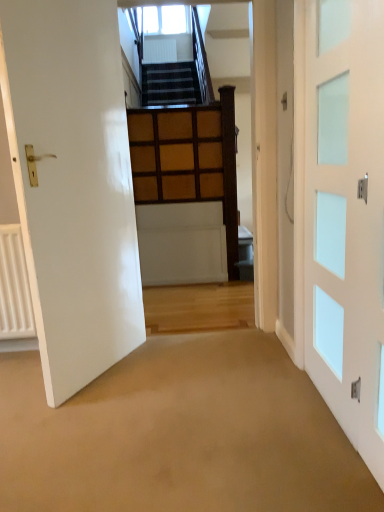
Question: Is white glass door at right, which appears as the 2th door when viewed from the left, facing towards clear glass window at upper center?

Choices:
 (A) no
 (B) yes

Answer: (A)

Question: From the image's perspective, is white glass door at right, which is the 1th door in right-to-left order, above clear glass window at upper center?

Choices:
 (A) no
 (B) yes

Answer: (A)

Question: Does white glass door at right, which appears as the 2th door when viewed from the left, have a greater width compared to clear glass window at upper center?

Choices:
 (A) yes
 (B) no

Answer: (B)

Question: Would you say white glass door at right, which appears as the 2th door when viewed from the left, contains clear glass window at upper center?

Choices:
 (A) no
 (B) yes

Answer: (A)

Question: Can you confirm if white glass door at right, which is the 1th door in right-to-left order, is shorter than clear glass window at upper center?

Choices:
 (A) yes
 (B) no

Answer: (B)

Question: From the image's perspective, is white glossy door at left, arranged as the 2th door when viewed from the right, located above or below clear glass window at upper center?

Choices:
 (A) above
 (B) below

Answer: (B)

Question: Is white glossy door at left, the 1th door in the left-to-right sequence, taller or shorter than clear glass window at upper center?

Choices:
 (A) short
 (B) tall

Answer: (B)

Question: In the image, is white glossy door at left, arranged as the 2th door when viewed from the right, positioned in front of or behind clear glass window at upper center?

Choices:
 (A) front
 (B) behind

Answer: (A)

Question: Based on their sizes in the image, would you say white glossy door at left, arranged as the 2th door when viewed from the right, is bigger or smaller than clear glass window at upper center?

Choices:
 (A) big
 (B) small

Answer: (A)

Question: Is point (153, 14) positioned closer to the camera than point (142, 332)?

Choices:
 (A) farther
 (B) closer

Answer: (A)

Question: Is clear glass window at upper center situated inside white glossy door at left, arranged as the 2th door when viewed from the right, or outside?

Choices:
 (A) outside
 (B) inside

Answer: (A)

Question: In the image, is clear glass window at upper center on the left side or the right side of white glossy door at left, arranged as the 2th door when viewed from the right?

Choices:
 (A) left
 (B) right

Answer: (B)

Question: From a real-world perspective, is clear glass window at upper center above or below white glossy door at left, the 1th door in the left-to-right sequence?

Choices:
 (A) below
 (B) above

Answer: (B)

Question: Looking at the image, does white glass door at right, which is the 1th door in right-to-left order, seem bigger or smaller compared to white glossy door at left, the 1th door in the left-to-right sequence?

Choices:
 (A) small
 (B) big

Answer: (A)

Question: In terms of width, does white glass door at right, which is the 1th door in right-to-left order, look wider or thinner when compared to white glossy door at left, the 1th door in the left-to-right sequence?

Choices:
 (A) thin
 (B) wide

Answer: (A)